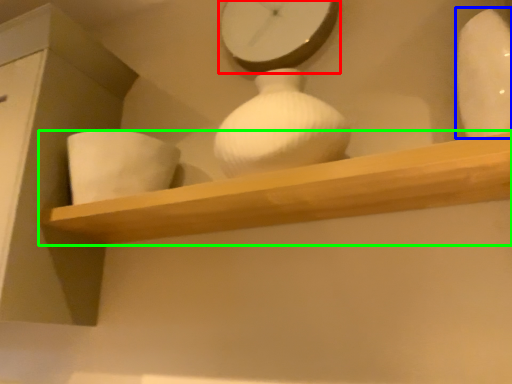
Question: Estimate the real-world distances between objects in this image. Which object is farther from clock (highlighted by a red box), vase (highlighted by a blue box) or shelf (highlighted by a green box)?

Choices:
 (A) vase
 (B) shelf

Answer: (B)